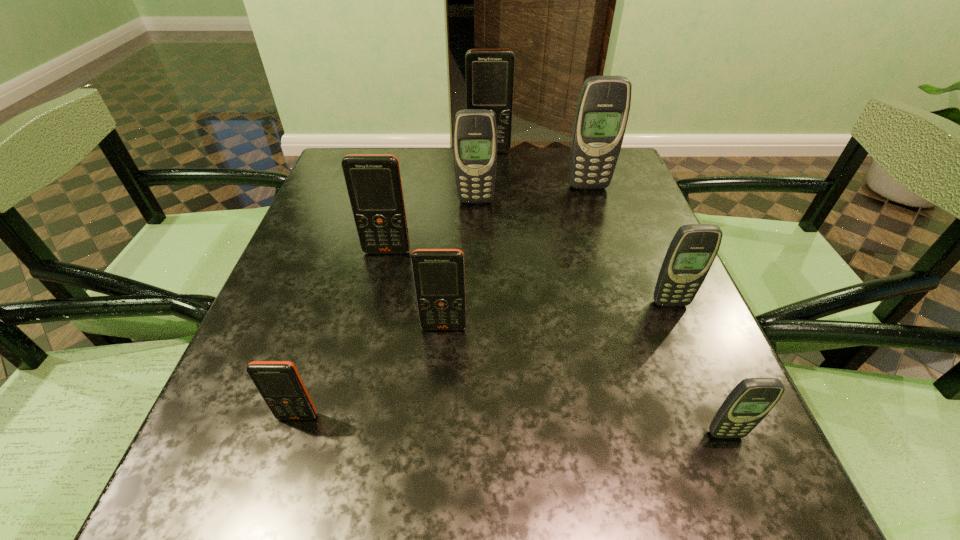
Identify the location of the farthest cellular telephone. (489, 72).

Locate an element on the screen. Image resolution: width=960 pixels, height=540 pixels. the farthest object is located at coordinates (489, 72).

Find the location of a particular element. the seventh nearest cellular telephone is located at coordinates (602, 112).

At what (x,y) coordinates should I click in order to perform the action: click on the farthest gray cellular telephone. Please return your answer as a coordinate pair (x, y). The image size is (960, 540). Looking at the image, I should click on (602, 112).

I want to click on the third smallest orange cellular telephone, so click(x=373, y=181).

Where is `the fourth farthest object`? Image resolution: width=960 pixels, height=540 pixels. the fourth farthest object is located at coordinates (373, 181).

The image size is (960, 540). In order to click on the third nearest gray cellular telephone in this screenshot , I will do `click(475, 134)`.

This screenshot has height=540, width=960. Find the location of `the second biggest gray cellular telephone`. the second biggest gray cellular telephone is located at coordinates (475, 134).

Find the location of `the second smallest gray cellular telephone`. the second smallest gray cellular telephone is located at coordinates (692, 251).

Locate an element on the screen. This screenshot has height=540, width=960. the fifth farthest object is located at coordinates (692, 251).